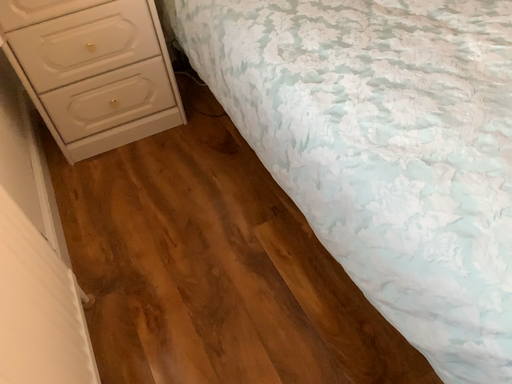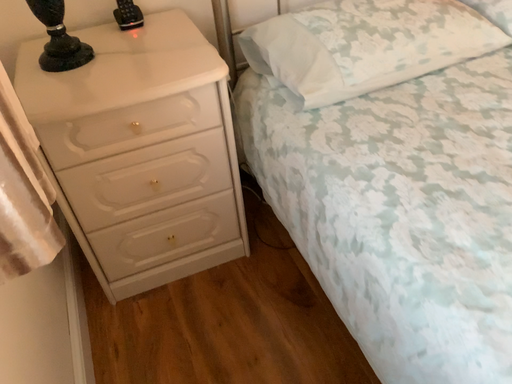
Question: Which way did the camera rotate in the video?

Choices:
 (A) rotated downward
 (B) rotated upward

Answer: (B)